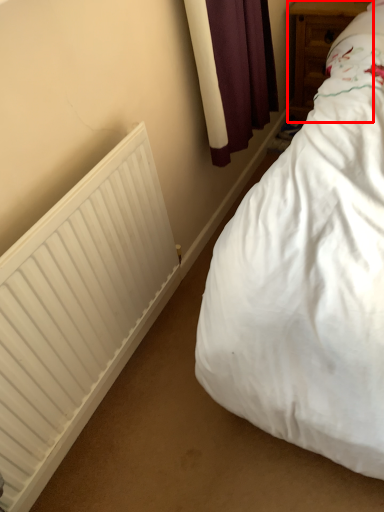
Question: Where is furniture (annotated by the red box) located in relation to radiator in the image?

Choices:
 (A) left
 (B) right

Answer: (B)